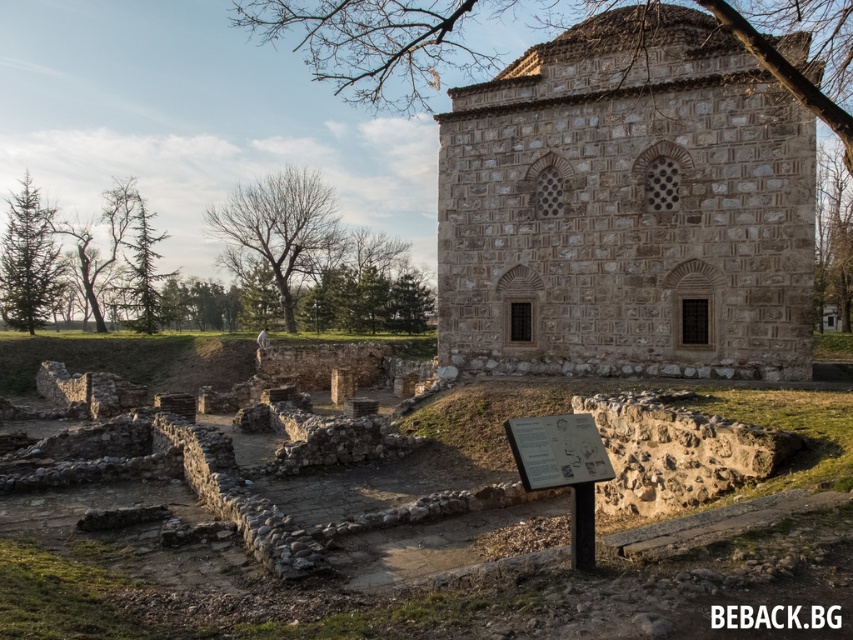
Question: Does brown stone church at center appear over black text at center?

Choices:
 (A) no
 (B) yes

Answer: (B)

Question: Among these objects, which one is farthest from the camera?

Choices:
 (A) black text at center
 (B) brown stone church at center

Answer: (B)

Question: Which point is closer to the camera taking this photo?

Choices:
 (A) (529, 188)
 (B) (714, 605)

Answer: (B)

Question: Is brown stone church at center positioned at the back of black text at center?

Choices:
 (A) yes
 (B) no

Answer: (A)

Question: Does brown stone church at center appear under black text at center?

Choices:
 (A) yes
 (B) no

Answer: (B)

Question: Among these points, which one is nearest to the camera?

Choices:
 (A) (457, 128)
 (B) (805, 627)

Answer: (B)